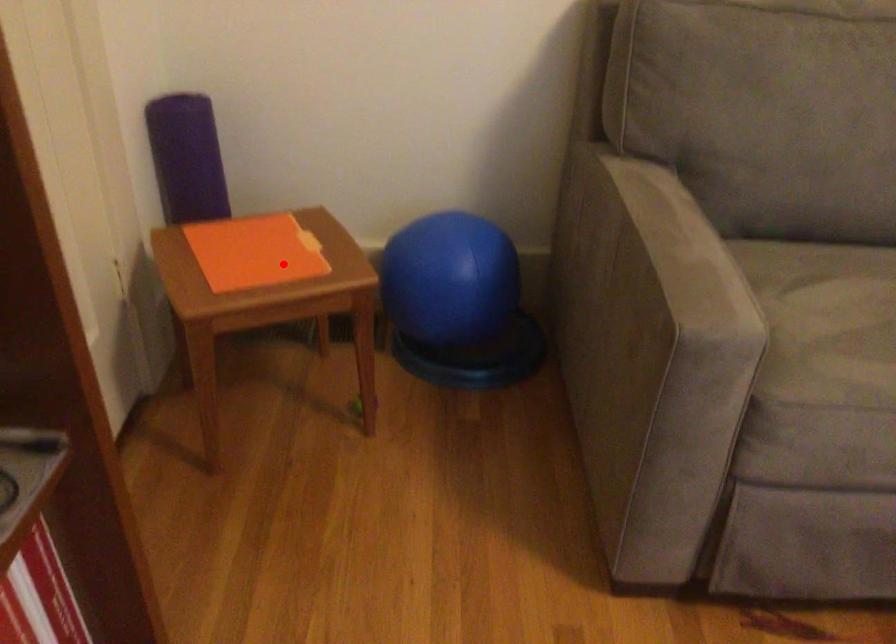
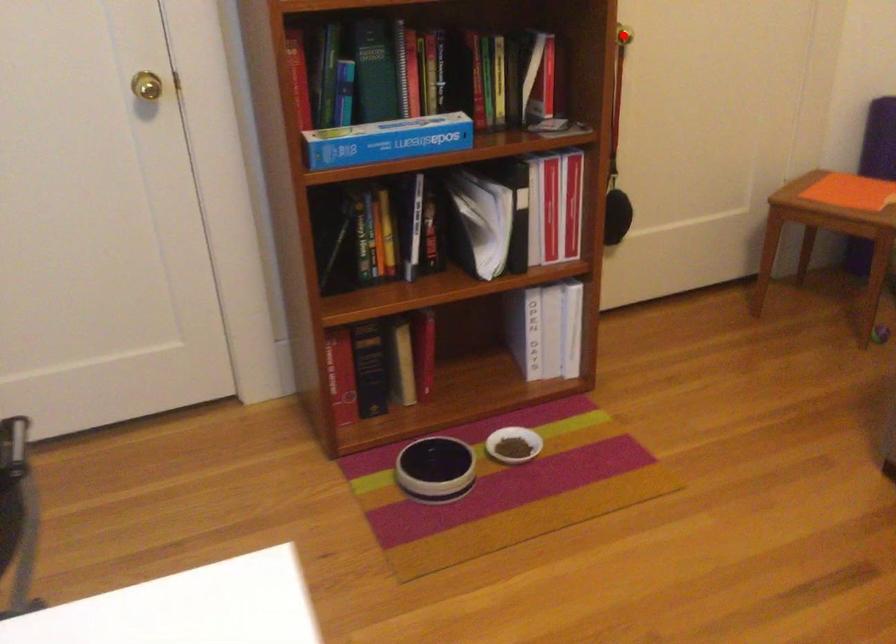
I am providing you with two images of the same scene from different viewpoints. A red point is marked on the first image and another point is marked on the second image. Is the red point in image1 aligned with the point shown in image2?

No